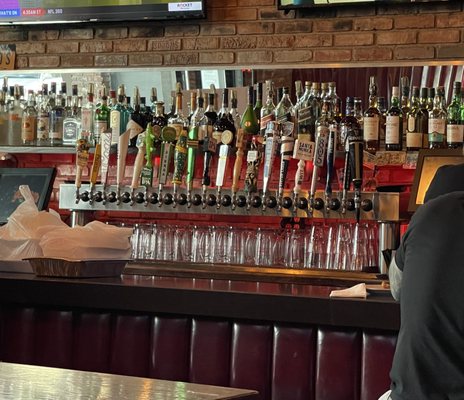
Locate an element on the screen. Image resolution: width=464 pixels, height=400 pixels. red brick wall is located at coordinates pos(256,49).